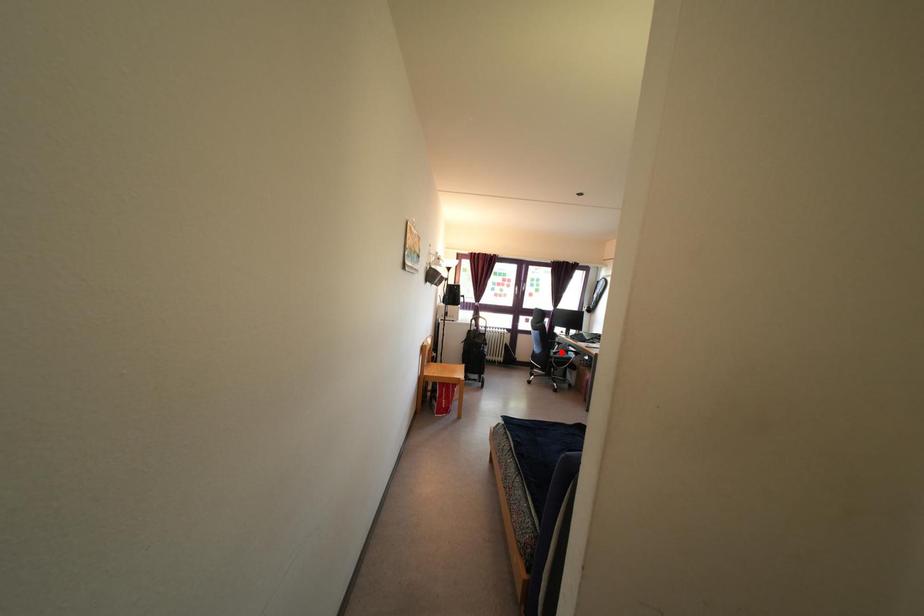
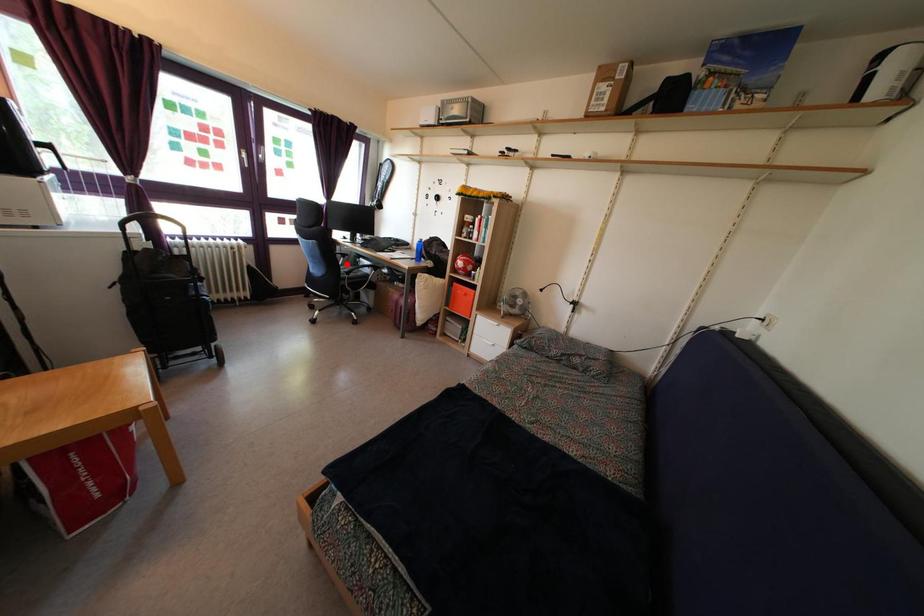
I am providing you with two images of the same scene from different viewpoints. A red point is marked on the first image and another point is marked on the second image. Do the highlighted points in image1 and image2 indicate the same real-world spot?

Yes